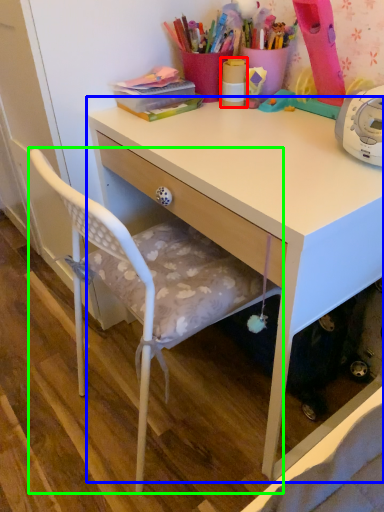
Question: Estimate the real-world distances between objects in this image. Which object is closer to office supplies (highlighted by a red box), desk (highlighted by a blue box) or chair (highlighted by a green box)?

Choices:
 (A) desk
 (B) chair

Answer: (A)